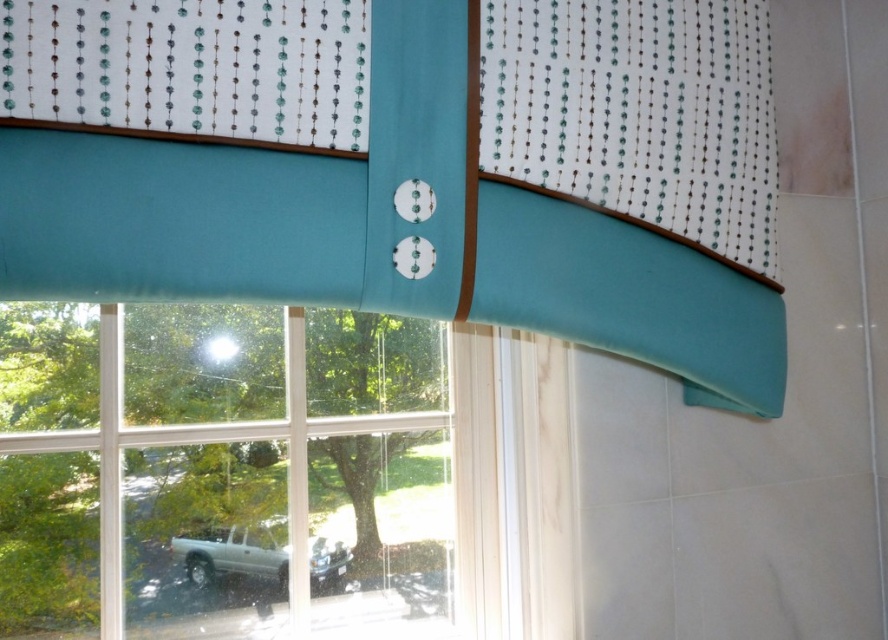
Which is behind, point (672, 355) or point (381, 384)?

Point (381, 384)

Locate an element on the screen. teal fabric valance at upper center is located at coordinates (409, 166).